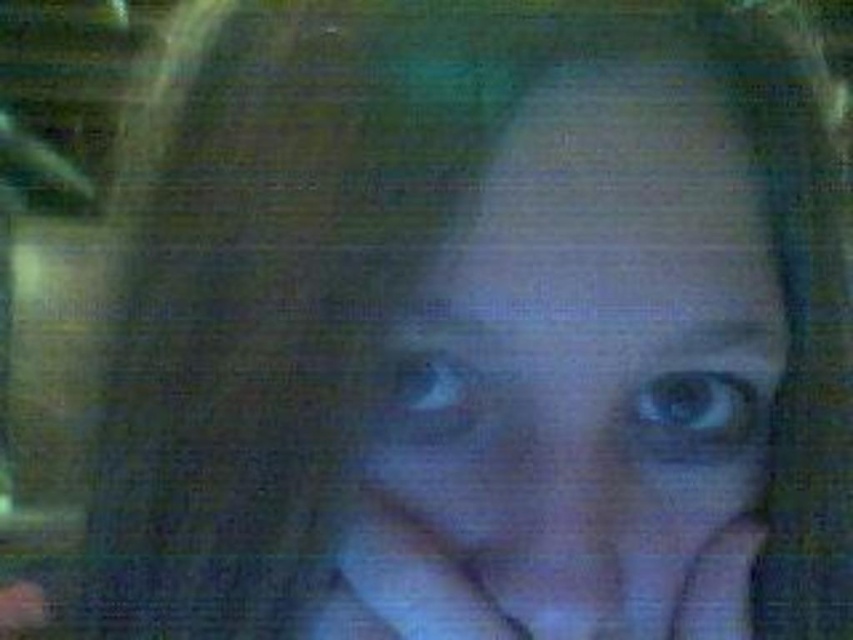
You are a photographer trying to capture a close up of a person. You want to ensure the subject is in focus. Given that the camera you are using has a depth of field of 10 inches, will the point at point (624, 230) be within the depth of field?

The distance of point (624, 230) from camera is 11.36 inches, which is beyond the camera depth of field of 10 inches. Therefore, the point at point (624, 230) will not be within the depth of field and may appear out of focus.

Based on the scene description, where is the smooth skin face at center located in terms of its 2D coordinates?

The smooth skin face at center is located at the 2D coordinates point (581, 384).